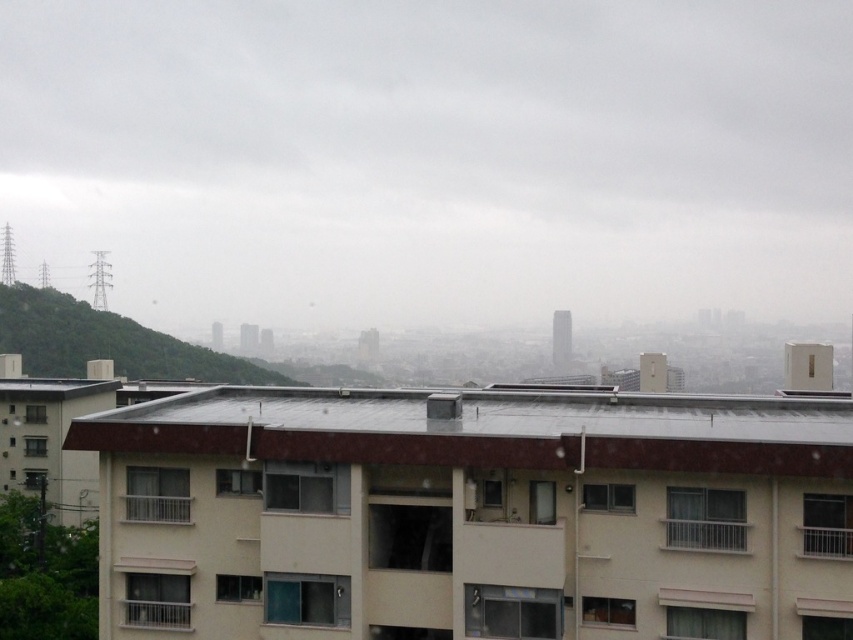
Which is more to the left, smooth gray roof at center or green leafy hillside at left?

Positioned to the left is green leafy hillside at left.

Does smooth gray roof at center lie behind green leafy hillside at left?

No, it is not.

Locate an element on the screen. The image size is (853, 640). smooth gray roof at center is located at coordinates pyautogui.click(x=486, y=429).